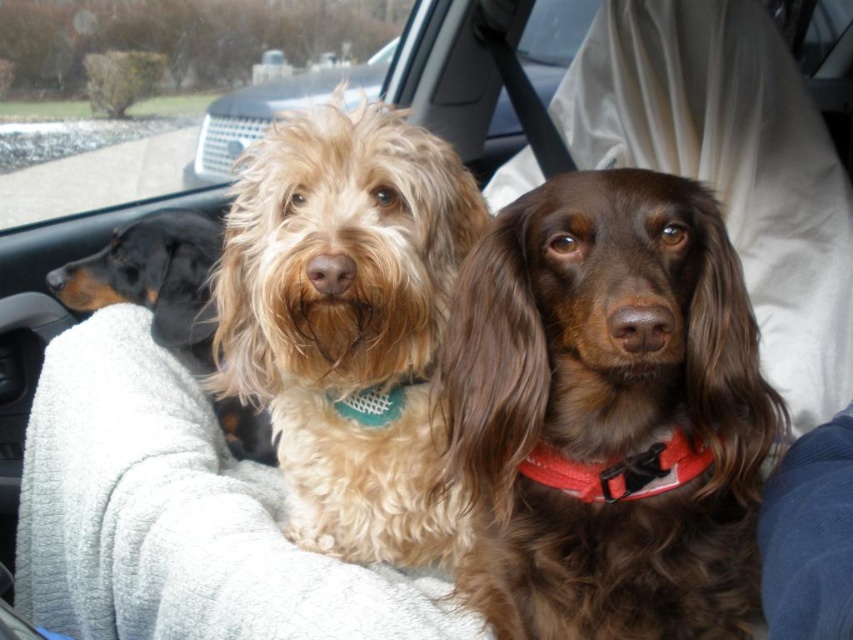
Is point (259, 296) closer to viewer compared to point (154, 100)?

Yes, it is.

Consider the image. Is the position of fuzzy beige dog at center more distant than that of transparent glass window at upper center?

No.

Measure the distance between point (x=242, y=209) and camera.

1.06 meters

Where is `fuzzy beige dog at center`? fuzzy beige dog at center is located at coordinates (347, 323).

Consider the image. Between brown shaggy dog at center and black smooth dachshund at left, which one is positioned higher?

black smooth dachshund at left

The height and width of the screenshot is (640, 853). What do you see at coordinates (608, 413) in the screenshot?
I see `brown shaggy dog at center` at bounding box center [608, 413].

Is point (672, 387) closer to viewer compared to point (79, 285)?

Yes, it is in front of point (79, 285).

Where is `brown shaggy dog at center`? The height and width of the screenshot is (640, 853). brown shaggy dog at center is located at coordinates (608, 413).

Between brown shaggy dog at center and fuzzy beige dog at center, which one appears on the right side from the viewer's perspective?

brown shaggy dog at center is more to the right.

Can you confirm if brown shaggy dog at center is wider than fuzzy beige dog at center?

No, brown shaggy dog at center is not wider than fuzzy beige dog at center.

Where is `brown shaggy dog at center`? This screenshot has width=853, height=640. brown shaggy dog at center is located at coordinates (608, 413).